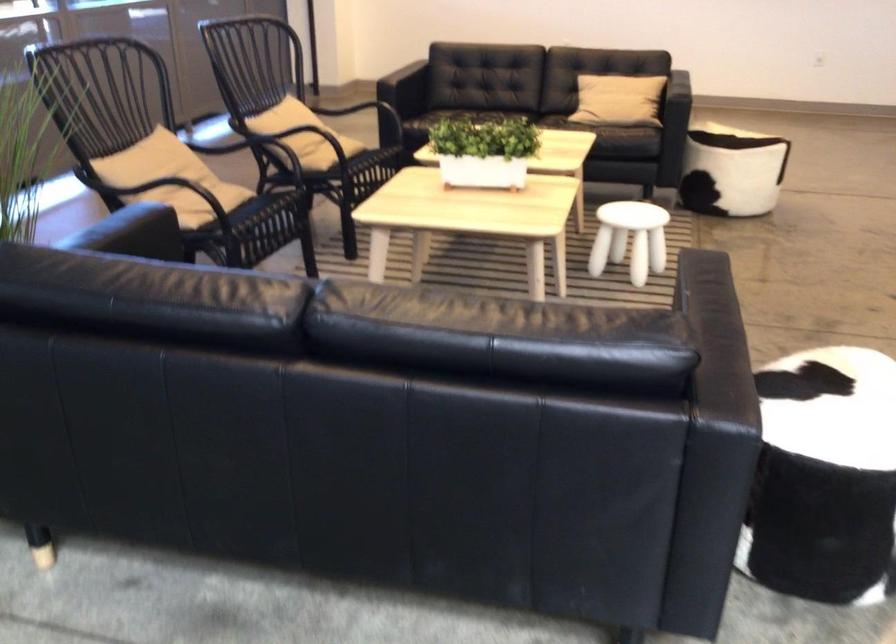
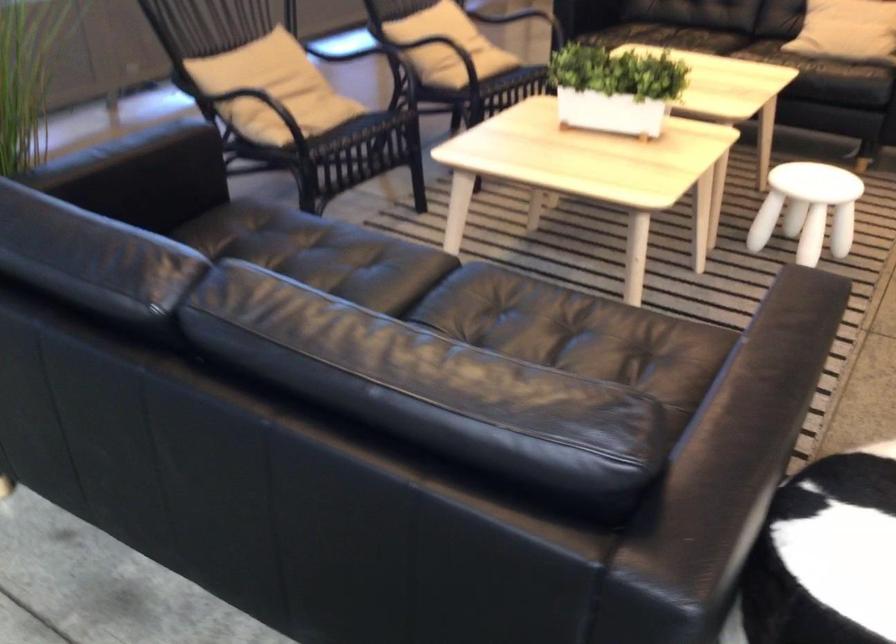
Find the pixel in the second image that matches point (487, 151) in the first image.

(615, 88)